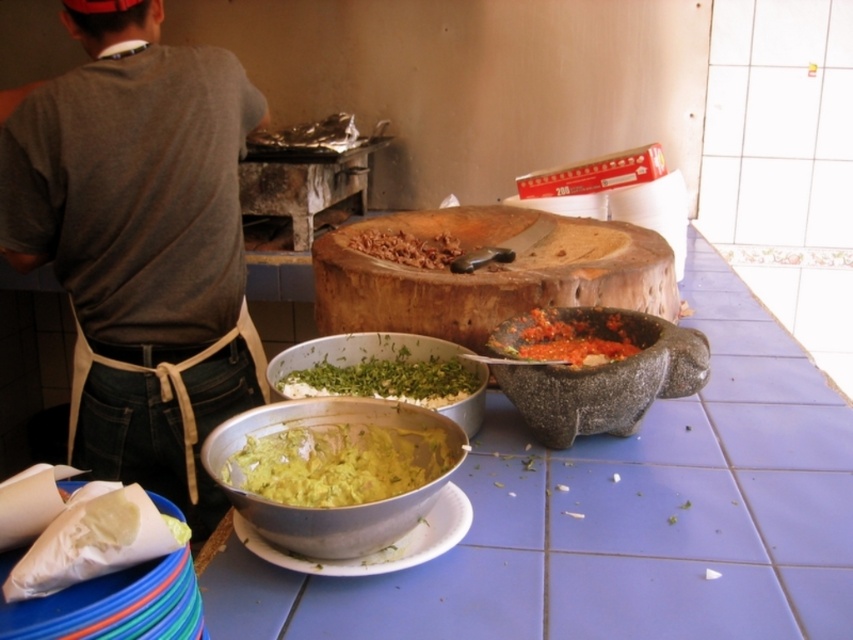
Between point (387, 451) and point (189, 556), which one is positioned behind?

The point (387, 451) is more distant.

Can you confirm if yellowish-green paste at center is positioned to the right of white paper cone at lower left?

Indeed, yellowish-green paste at center is positioned on the right side of white paper cone at lower left.

Between point (358, 449) and point (112, 611), which one is positioned behind?

Positioned behind is point (358, 449).

What are the coordinates of `yellowish-green paste at center` in the screenshot? It's located at (339, 464).

Is gray stone mortar at center bigger than yellowish-green paste at center?

Yes, gray stone mortar at center is bigger than yellowish-green paste at center.

Does point (566, 336) lie in front of point (381, 436)?

No.

Where is `gray stone mortar at center`? The height and width of the screenshot is (640, 853). gray stone mortar at center is located at coordinates (595, 369).

Which is above, yellowish-green paste at center or green leafymaterial/texture at center?

green leafymaterial/texture at center

Where is `yellowish-green paste at center`? This screenshot has width=853, height=640. yellowish-green paste at center is located at coordinates (339, 464).

Image resolution: width=853 pixels, height=640 pixels. Identify the location of yellowish-green paste at center. (339, 464).